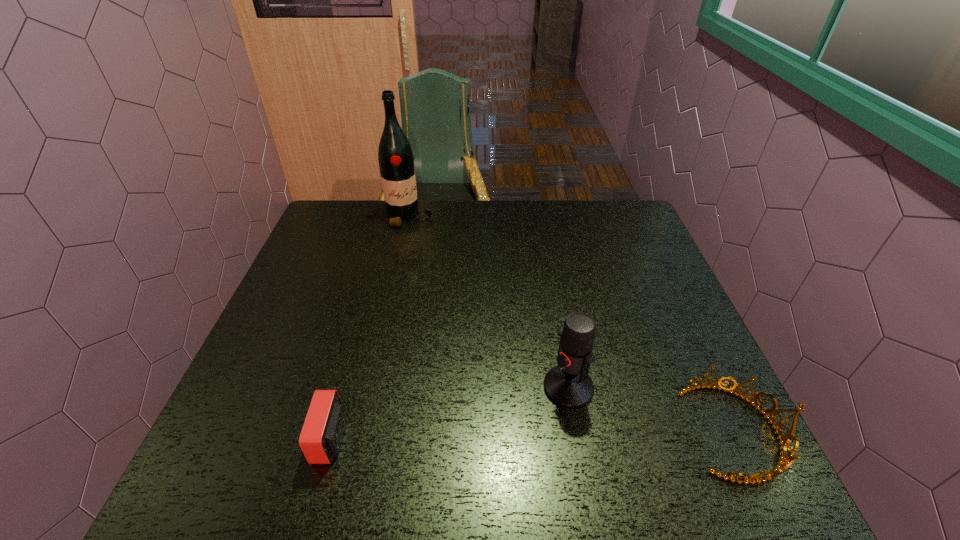
Where is `free space located on the surface of the farthest object`? Image resolution: width=960 pixels, height=540 pixels. free space located on the surface of the farthest object is located at coordinates (454, 287).

You are a GUI agent. You are given a task and a screenshot of the screen. Output one action in this format:
    pyautogui.click(x=<x>, y=<y>)
    Task: Click on the free region located 0.200m on the surface of the farthest object
    This screenshot has width=960, height=540.
    Given the screenshot: What is the action you would take?
    [x=440, y=264]

Locate an element on the screen. This screenshot has width=960, height=540. vacant space located on the side of the microphone with the red ring is located at coordinates (498, 430).

Locate an element on the screen. This screenshot has height=540, width=960. free spot located 0.060m on the side of the microphone with the red ring is located at coordinates (527, 413).

This screenshot has height=540, width=960. Identify the location of vacant region located on the side of the microphone with the red ring. (482, 441).

What are the coordinates of `object located in the far edge section of the desktop` in the screenshot? It's located at coord(395,156).

Image resolution: width=960 pixels, height=540 pixels. What are the coordinates of `alarm clock that is at the near edge` in the screenshot? It's located at (321, 437).

The width and height of the screenshot is (960, 540). I want to click on tiara positioned at the near edge, so click(784, 441).

Locate an element on the screen. The image size is (960, 540). microphone that is at the near edge is located at coordinates (568, 385).

Where is `object present at the right edge`? The image size is (960, 540). object present at the right edge is located at coordinates (784, 441).